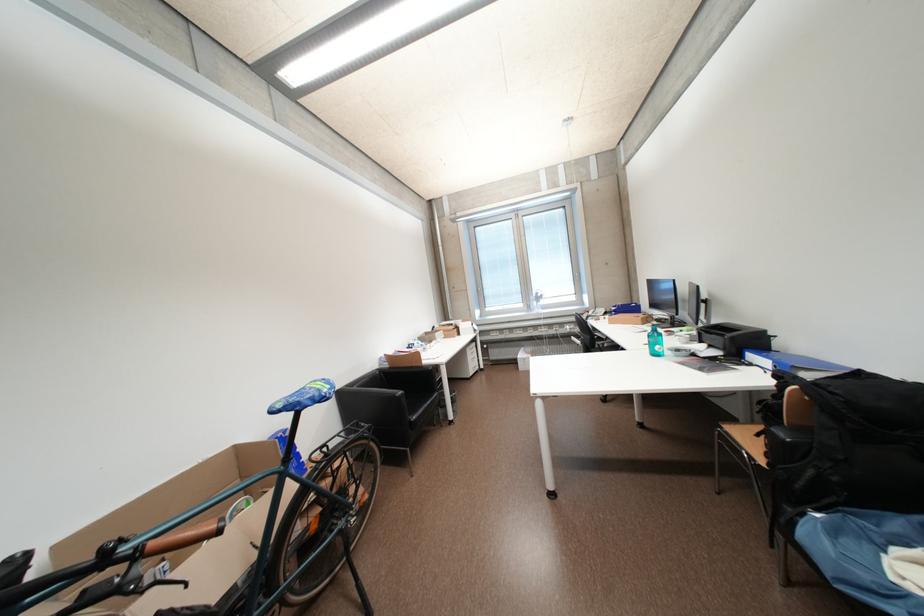
In order to click on silver window handle in this screenshot , I will do `click(537, 300)`.